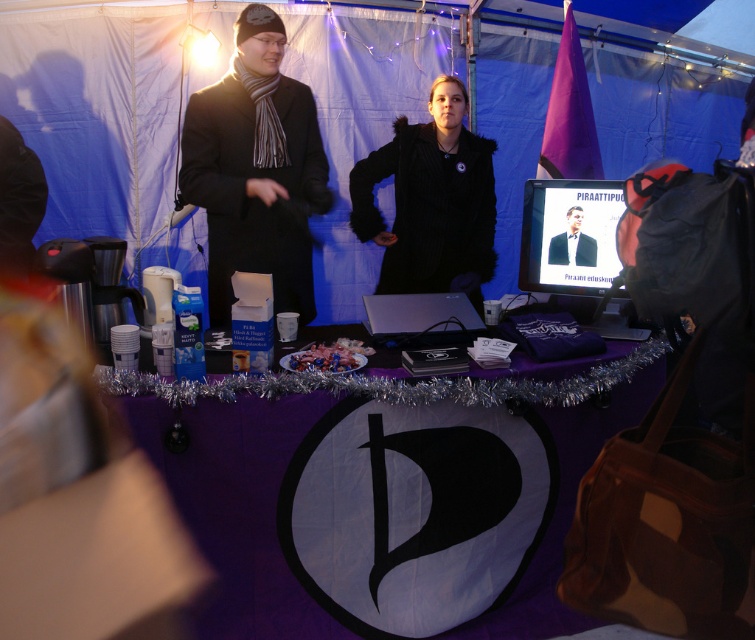
You are organizing a costume party and need to decide which outfit to wear. You have a black woolen coat at center and a matte black suit at center available. Based on the scene description, which one would be more appropriate for a formal presentation?

The matte black suit at center is more appropriate for a formal presentation as it is sleek and professional, unlike the black woolen coat at center which might be too casual for such an event.

You are standing in front of the tent structure and want to determine the relative positions of two points marked on the table. Which point is closer to you, point (510, 528) or point (587, 241)?

Point (510, 528) is closer to the viewer than point (587, 241).